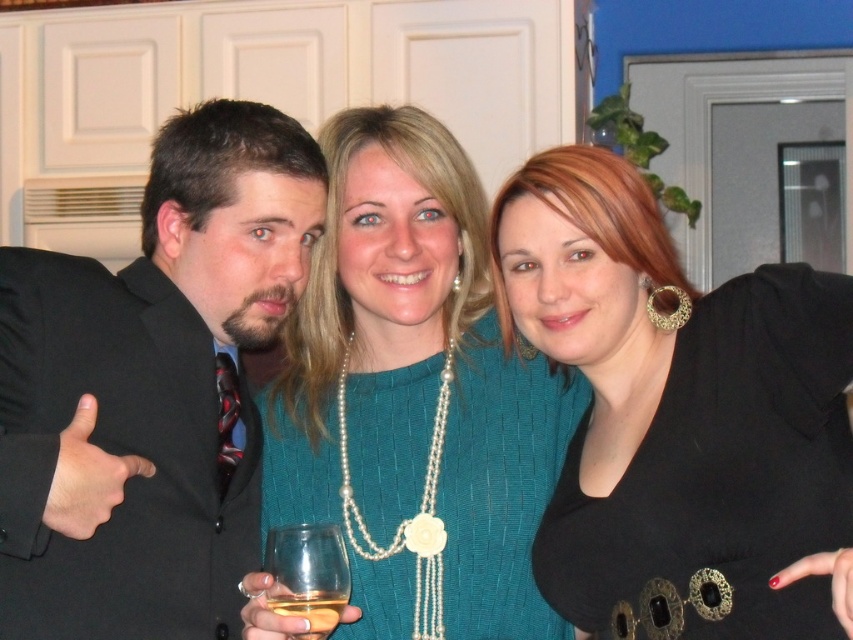
What do you see at coordinates (154, 385) in the screenshot? The image size is (853, 640). I see `black suit at left` at bounding box center [154, 385].

Between black suit at left and teal knitwear at center, which one has more height?

Standing taller between the two is teal knitwear at center.

Who is more distant from viewer, (x=38, y=618) or (x=524, y=608)?

Positioned behind is point (x=524, y=608).

Where is `black suit at left`? black suit at left is located at coordinates (154, 385).

Is black leather dress at right to the left of clear glass wine glass at center from the viewer's perspective?

No, black leather dress at right is not to the left of clear glass wine glass at center.

Does point (635, 332) come behind point (277, 566)?

Yes, it is.

You are a GUI agent. You are given a task and a screenshot of the screen. Output one action in this format:
    pyautogui.click(x=<x>, y=<y>)
    Task: Click on the black leather dress at right
    
    Given the screenshot: What is the action you would take?
    pyautogui.click(x=680, y=417)

Is point (532, 381) less distant than point (265, 596)?

That is False.

Is the position of teal knitwear at center less distant than that of translucent glass at center?

No, teal knitwear at center is behind translucent glass at center.

Who is more distant from viewer, (447, 486) or (317, 636)?

The point (447, 486) is behind.

I want to click on teal knitwear at center, so click(415, 390).